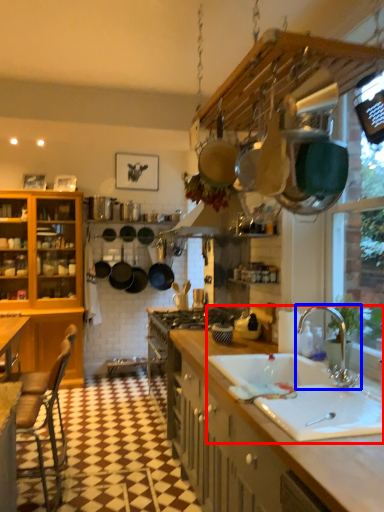
Question: Which object is further to the camera taking this photo, sink (highlighted by a red box) or tap (highlighted by a blue box)?

Choices:
 (A) sink
 (B) tap

Answer: (B)